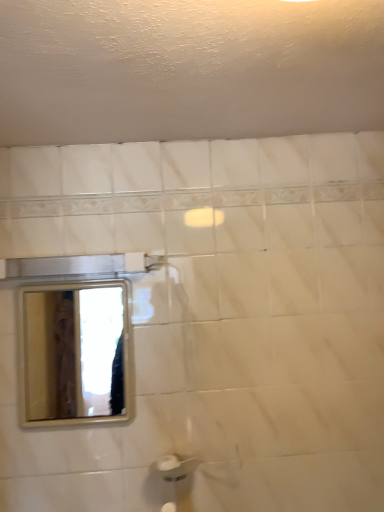
Image resolution: width=384 pixels, height=512 pixels. Describe the element at coordinates (75, 352) in the screenshot. I see `silver metallic mirror at upper center` at that location.

Image resolution: width=384 pixels, height=512 pixels. What are the coordinates of `silver metallic mirror at upper center` in the screenshot? It's located at (75, 352).

Locate an element on the screen. This screenshot has width=384, height=512. silver metallic mirror at upper center is located at coordinates (75, 352).